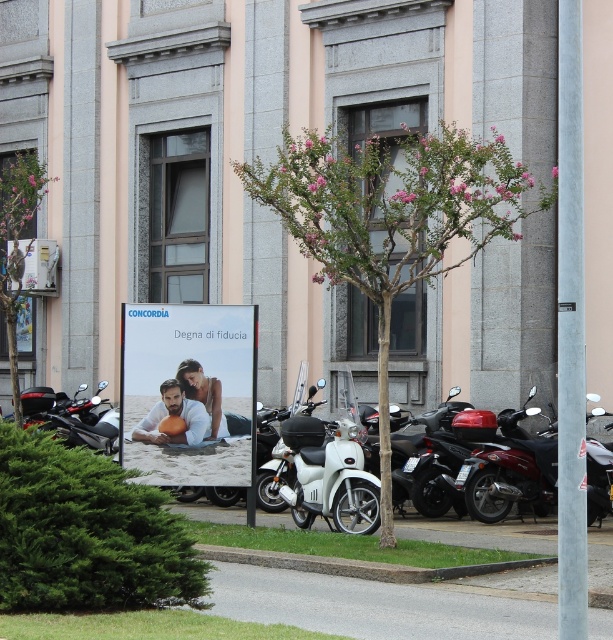
Question: Is green leafy tree at left below matte black scooter at left?

Choices:
 (A) yes
 (B) no

Answer: (B)

Question: Does shiny red motorcycle at center right appear under smooth skin person at center?

Choices:
 (A) no
 (B) yes

Answer: (B)

Question: Estimate the real-world distances between objects in this image. Which object is closer to the shiny black scooter at center?

Choices:
 (A) pink flowering tree at center
 (B) shiny red motorcycle at center right

Answer: (B)

Question: Considering the real-world distances, which object is closest to the matte black scooter at left?

Choices:
 (A) matte white billboard at center
 (B) pink flowering tree at center
 (C) smooth tan skin at center

Answer: (A)

Question: Is matte white billboard at center behind white matte scooter at center?

Choices:
 (A) yes
 (B) no

Answer: (A)

Question: Which object is the closest to the smooth skin person at center?

Choices:
 (A) shiny red motorcycle at center right
 (B) matte white billboard at center
 (C) white matte scooter at center
 (D) pink flowering tree at center

Answer: (B)